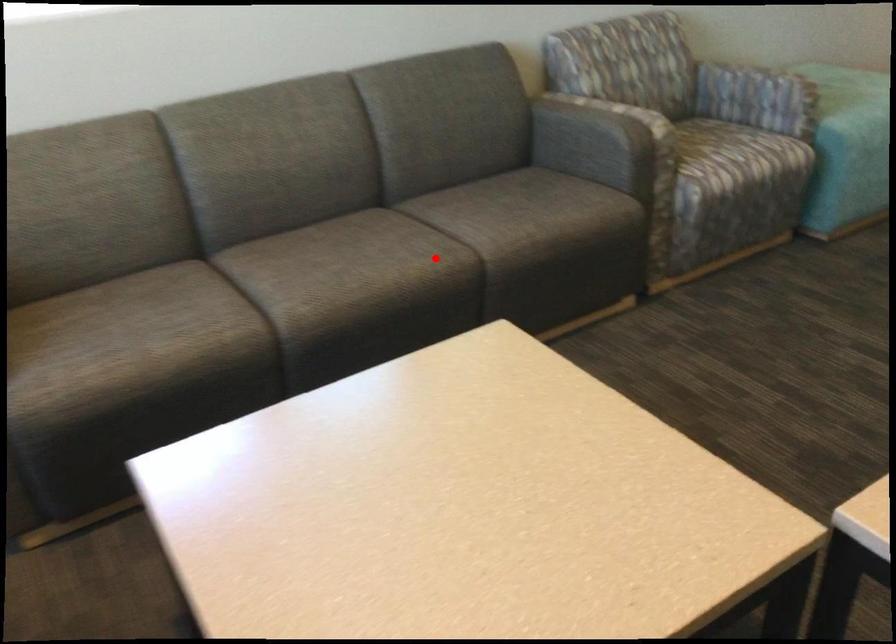
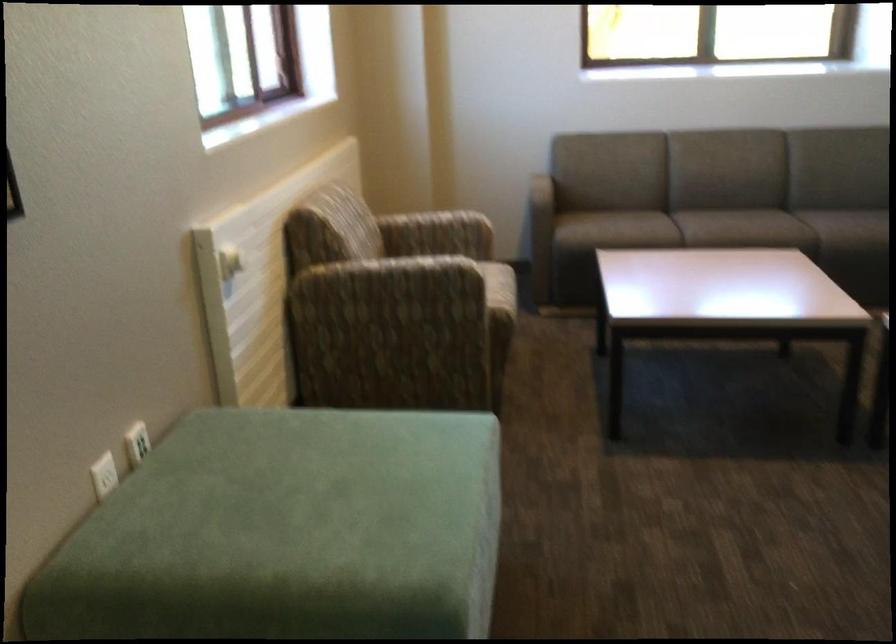
Question: I am providing you with two images of the same scene from different viewpoints. A red point is shown in image1. For the corresponding object point in image2, is it positioned nearer or farther from the camera?

Choices:
 (A) Nearer
 (B) Farther

Answer: (B)